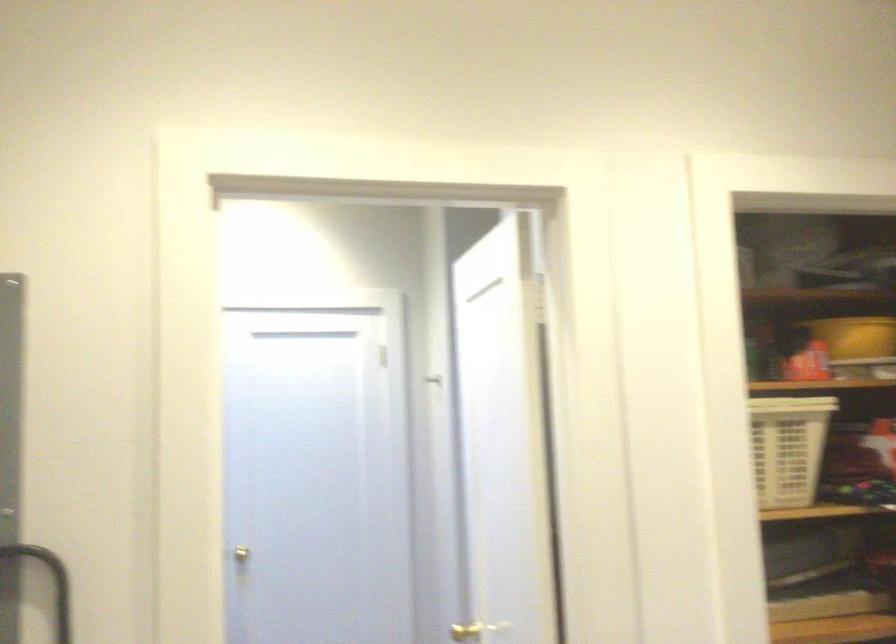
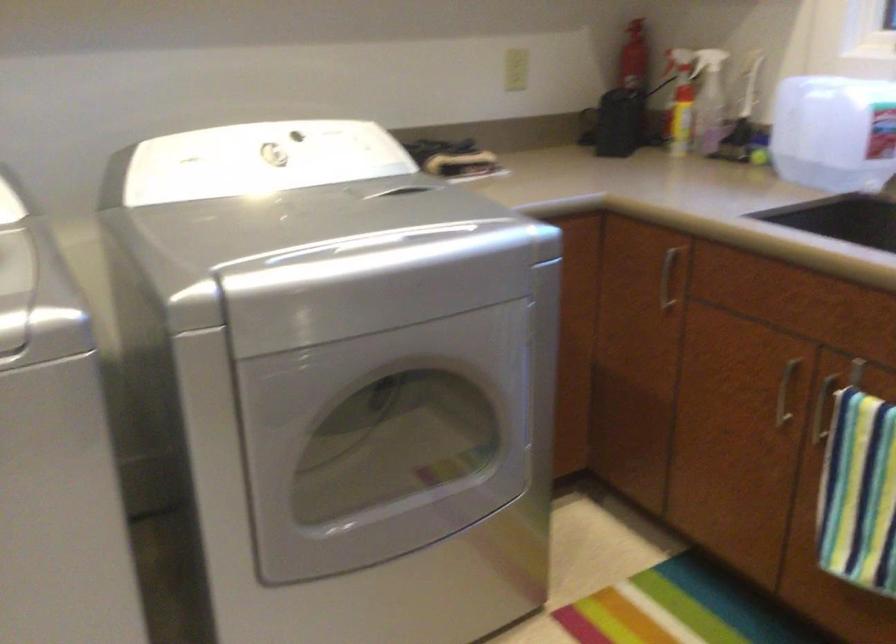
From the picture: How did the camera likely rotate?

The rotation direction of the camera is right-down.